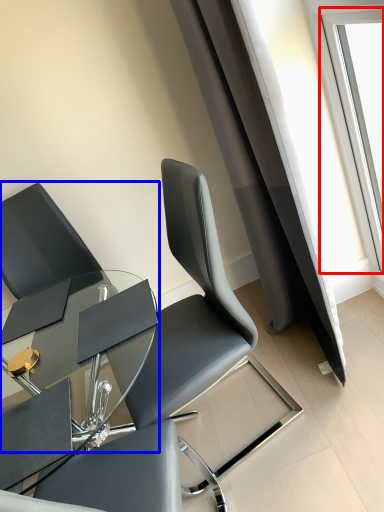
Question: Which object appears farthest to the camera in this image, window (highlighted by a red box) or chair (highlighted by a blue box)?

Choices:
 (A) window
 (B) chair

Answer: (B)